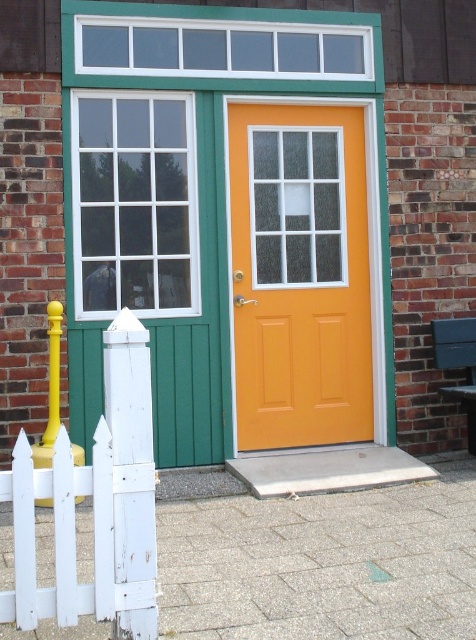
Between orange matte door at center and white wooden picket fence at left, which one has more height?

orange matte door at center is taller.

Does orange matte door at center appear on the right side of white wooden picket fence at left?

Correct, you'll find orange matte door at center to the right of white wooden picket fence at left.

Does point (340, 276) come behind point (134, 512)?

Yes, it is behind point (134, 512).

Locate an element on the screen. The image size is (476, 640). orange matte door at center is located at coordinates (299, 275).